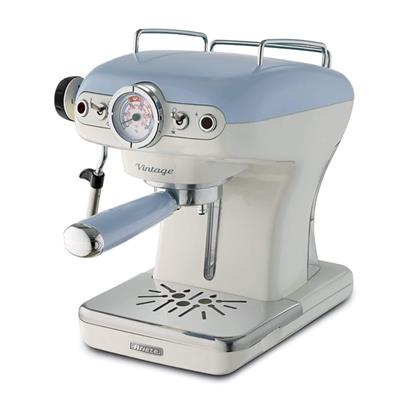
Where is `cup stand`? The height and width of the screenshot is (416, 416). cup stand is located at coordinates [x=215, y=329].